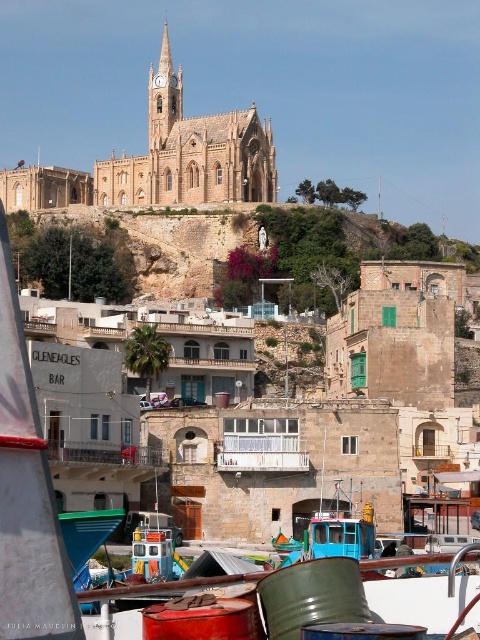
The height and width of the screenshot is (640, 480). Describe the element at coordinates (162, 160) in the screenshot. I see `beige stone church at upper center` at that location.

Does beige stone church at upper center have a greater width compared to brown stone hillside at center?

Incorrect, beige stone church at upper center's width does not surpass brown stone hillside at center's.

Is point (245, 188) more distant than point (382, 250)?

Yes.

Find the location of a particular element. This screenshot has height=640, width=480. beige stone church at upper center is located at coordinates (162, 160).